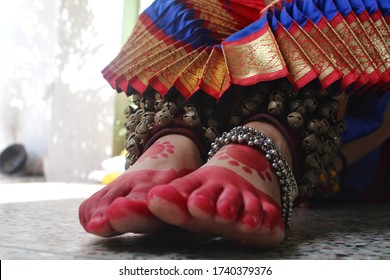
I want to click on grey bowl, so click(x=17, y=161).